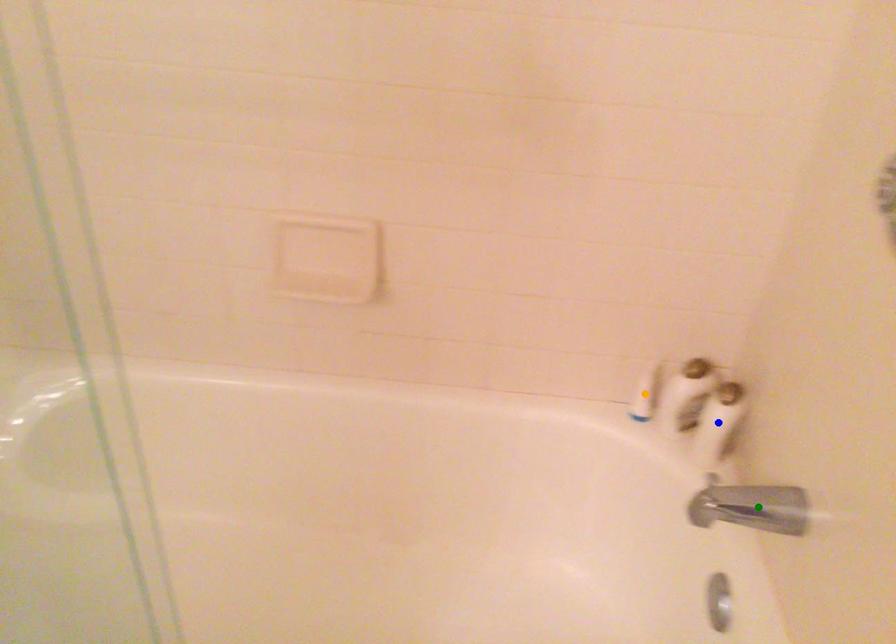
Order these from nearest to farthest:
green point
orange point
blue point

green point → blue point → orange point